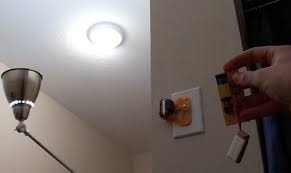
Find the location of a particular element. The height and width of the screenshot is (173, 291). white walls is located at coordinates (62, 138), (184, 59), (140, 160).